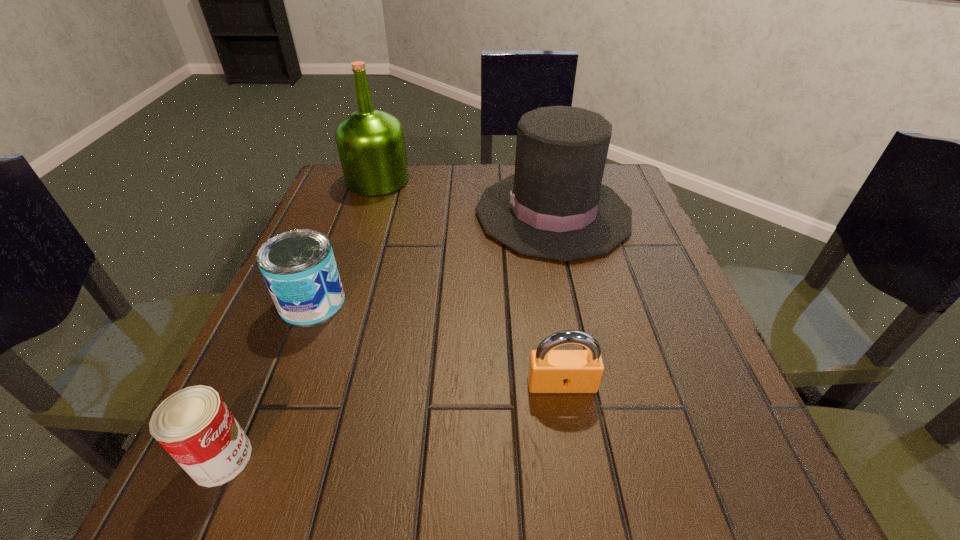
I want to click on vacant space at the far edge of the desktop, so click(x=437, y=200).

This screenshot has height=540, width=960. In the image, there is a desktop. What are the coordinates of `vacant space at the near edge` in the screenshot? It's located at (334, 502).

Where is `blank area at the left edge`? blank area at the left edge is located at coordinates (277, 394).

You are a GUI agent. You are given a task and a screenshot of the screen. Output one action in this format:
    pyautogui.click(x=<x>, y=<y>)
    Task: Click on the vacant point at the right edge
    This screenshot has width=960, height=540.
    Given the screenshot: What is the action you would take?
    pyautogui.click(x=667, y=302)

This screenshot has height=540, width=960. I want to click on vacant area at the far left corner of the desktop, so click(x=385, y=197).

Identify the location of free space at the far right corner. The image size is (960, 540). (624, 197).

At what (x,y) coordinates should I click in order to perform the action: click on free spot between the second nearest object and the tallest object. Please return your answer as a coordinate pair (x, y). Image resolution: width=960 pixels, height=540 pixels. Looking at the image, I should click on click(469, 282).

Identify the location of empty space that is in between the second tallest object and the padlock. (558, 299).

Identify the location of free space between the olive oil and the farther can. This screenshot has height=540, width=960. point(345,241).

Where is `unoccupied area between the second nearest object and the olive oil`? unoccupied area between the second nearest object and the olive oil is located at coordinates click(469, 282).